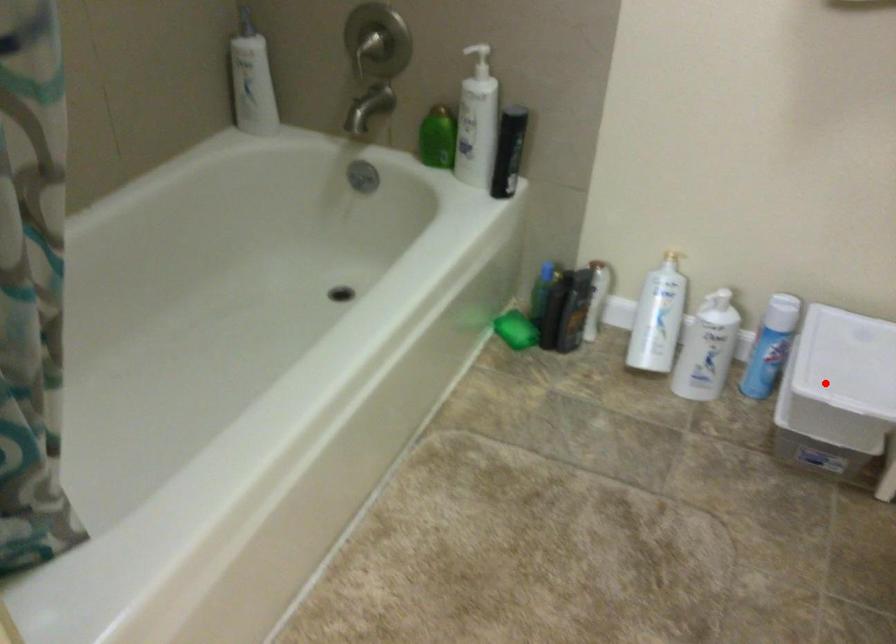
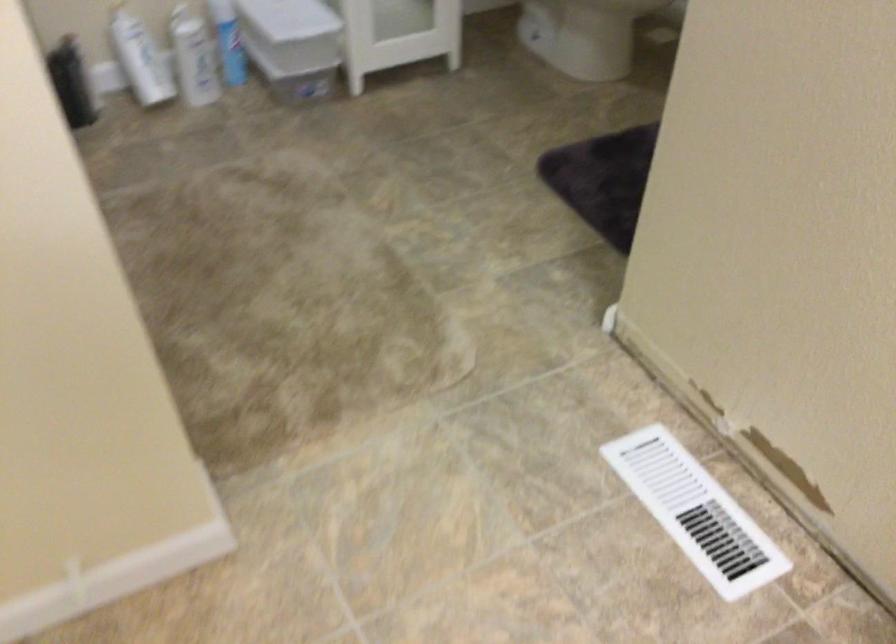
Question: I am providing you with two images of the same scene from different viewpoints. In image1, a red point is highlighted. Considering the same 3D point in image2, which of the following is correct?

Choices:
 (A) It is closer
 (B) It is farther

Answer: (B)